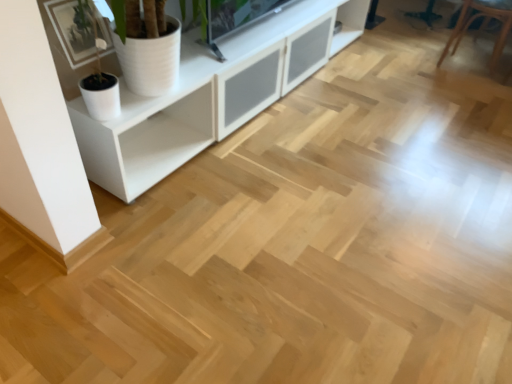
Question: From the image's perspective, is white matte pot at upper left under white matte cabinet at upper left?

Choices:
 (A) yes
 (B) no

Answer: (A)

Question: Is white matte pot at upper left positioned in front of white matte cabinet at upper left?

Choices:
 (A) no
 (B) yes

Answer: (A)

Question: Is white matte pot at upper left smaller than white matte cabinet at upper left?

Choices:
 (A) no
 (B) yes

Answer: (B)

Question: Is white matte pot at upper left thinner than white matte cabinet at upper left?

Choices:
 (A) yes
 (B) no

Answer: (A)

Question: Is white matte pot at upper left facing away from white matte cabinet at upper left?

Choices:
 (A) no
 (B) yes

Answer: (B)

Question: Based on their sizes in the image, would you say white matte pot at upper left is bigger or smaller than brown leather armchair at upper right?

Choices:
 (A) big
 (B) small

Answer: (B)

Question: Considering their positions, is white matte pot at upper left located in front of or behind brown leather armchair at upper right?

Choices:
 (A) behind
 (B) front

Answer: (B)

Question: Is white matte pot at upper left taller or shorter than brown leather armchair at upper right?

Choices:
 (A) tall
 (B) short

Answer: (B)

Question: Is white matte pot at upper left to the left or to the right of brown leather armchair at upper right in the image?

Choices:
 (A) right
 (B) left

Answer: (B)

Question: From a real-world perspective, is white matte cabinet at upper left positioned above or below white matte pot at upper left?

Choices:
 (A) above
 (B) below

Answer: (A)

Question: Considering the relative positions of white matte cabinet at upper left and white matte pot at upper left in the image provided, is white matte cabinet at upper left to the left or to the right of white matte pot at upper left?

Choices:
 (A) right
 (B) left

Answer: (A)

Question: In the image, is white matte cabinet at upper left positioned in front of or behind white matte pot at upper left?

Choices:
 (A) front
 (B) behind

Answer: (A)

Question: Is white matte cabinet at upper left situated inside white matte pot at upper left or outside?

Choices:
 (A) outside
 (B) inside

Answer: (A)

Question: Relative to brown leather armchair at upper right, is white matte cabinet at upper left in front or behind?

Choices:
 (A) front
 (B) behind

Answer: (A)

Question: Is white matte cabinet at upper left spatially inside brown leather armchair at upper right, or outside of it?

Choices:
 (A) inside
 (B) outside

Answer: (B)